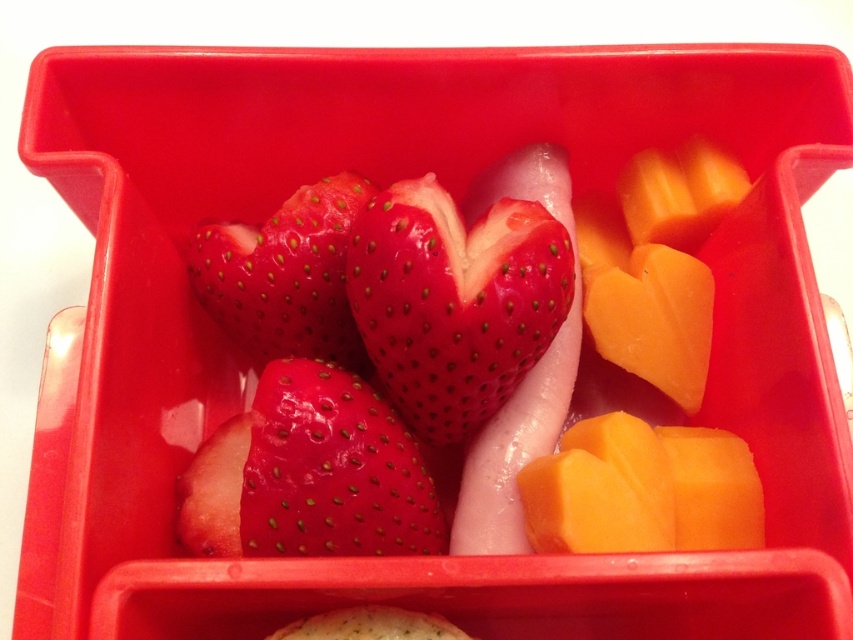
Is smooth red strawberry at center smaller than glossy red strawberry at center?

No, smooth red strawberry at center is not smaller than glossy red strawberry at center.

Is point (247, 490) behind point (213, 260)?

No, it is not.

Does point (314, 364) come farther from viewer compared to point (270, 278)?

That is False.

Find the location of a particular element. Image resolution: width=853 pixels, height=640 pixels. smooth red strawberry at center is located at coordinates click(332, 470).

Based on the photo, is shiny red strawberry at center thinner than smooth red strawberry at center?

In fact, shiny red strawberry at center might be wider than smooth red strawberry at center.

Does shiny red strawberry at center appear under smooth red strawberry at center?

No, shiny red strawberry at center is not below smooth red strawberry at center.

The width and height of the screenshot is (853, 640). I want to click on shiny red strawberry at center, so tap(454, 300).

Is point (421, 392) less distant than point (322, 220)?

Yes, point (421, 392) is in front of point (322, 220).

Locate an element on the screen. shiny red strawberry at center is located at coordinates (454, 300).

Who is more forward, (480, 244) or (329, 326)?

Point (480, 244) is more forward.

You are a GUI agent. You are given a task and a screenshot of the screen. Output one action in this format:
    pyautogui.click(x=<x>, y=<y>)
    Task: Click on the shiny red strawberry at center
    
    Given the screenshot: What is the action you would take?
    pyautogui.click(x=454, y=300)